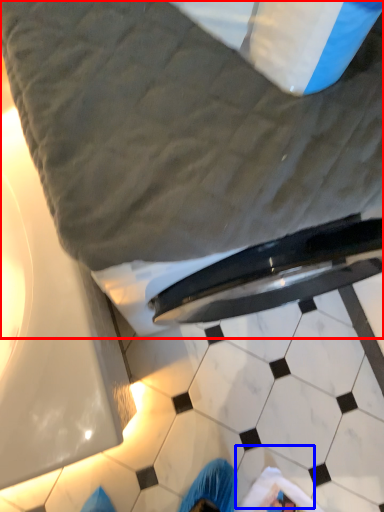
Question: Which object appears closest to the camera in this image, bed (highlighted by a red box) or tile (highlighted by a blue box)?

Choices:
 (A) bed
 (B) tile

Answer: (A)